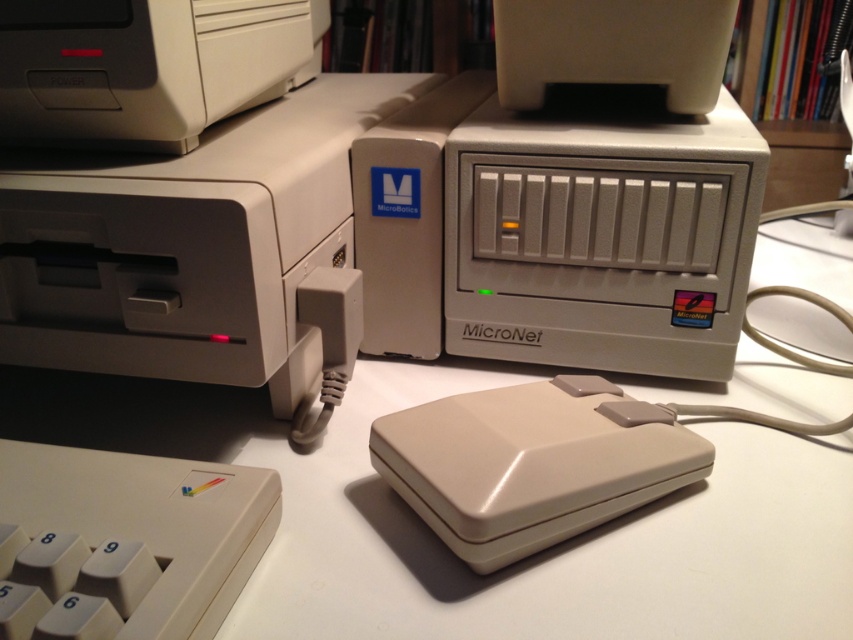
You are setting up a retro computing exhibit and need to place the matte plastic micronet at center so that it is exactly 24 inches away from the nearest object. Currently, the distance between them is 22.35 inches. How much more space, in inches, do you need to add to achieve the desired distance?

You need to add 1.65 inches more space to reach the desired 24 inches distance between the matte plastic micronet at center and the nearest object.

You are setting up a home office and want to arrange the matte plastic micronet at center and the matte white printer at upper left on your desk. Based on the image, which object should be placed higher up on the desk to match the original arrangement?

The matte white printer at upper left should be placed higher up on the desk since the matte plastic micronet at center is located below it in the original arrangement.